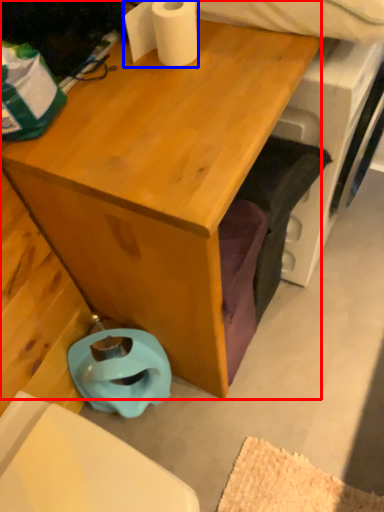
Question: Which object is closer to the camera taking this photo, desk (highlighted by a red box) or toilet paper (highlighted by a blue box)?

Choices:
 (A) desk
 (B) toilet paper

Answer: (A)